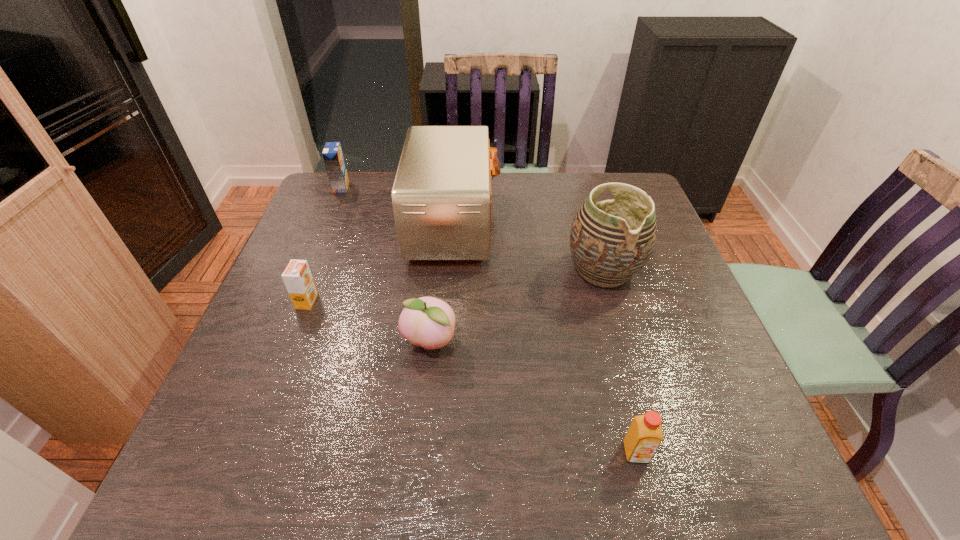
Locate an element on the screen. vacant space located 0.250m on the left of the peach is located at coordinates (288, 342).

At what (x,y) coordinates should I click in order to perform the action: click on free space located on the back of the second nearest orange juice. Please return your answer as a coordinate pair (x, y). The image size is (960, 540). Looking at the image, I should click on (344, 207).

Find the location of a particular element. toaster oven that is at the far edge is located at coordinates (441, 197).

This screenshot has width=960, height=540. I want to click on orange_juice at the far edge, so click(332, 153).

Identify the location of object at the near edge. This screenshot has height=540, width=960. [644, 435].

This screenshot has width=960, height=540. I want to click on object positioned at the right edge, so click(x=611, y=241).

Where is `object that is at the far left corner`? This screenshot has height=540, width=960. object that is at the far left corner is located at coordinates (332, 153).

The width and height of the screenshot is (960, 540). In the image, there is a desktop. Identify the location of vacant space at the far edge. (525, 176).

I want to click on vacant space at the left edge of the desktop, so click(x=334, y=223).

The image size is (960, 540). Identify the location of vacant space at the right edge of the desktop. (632, 315).